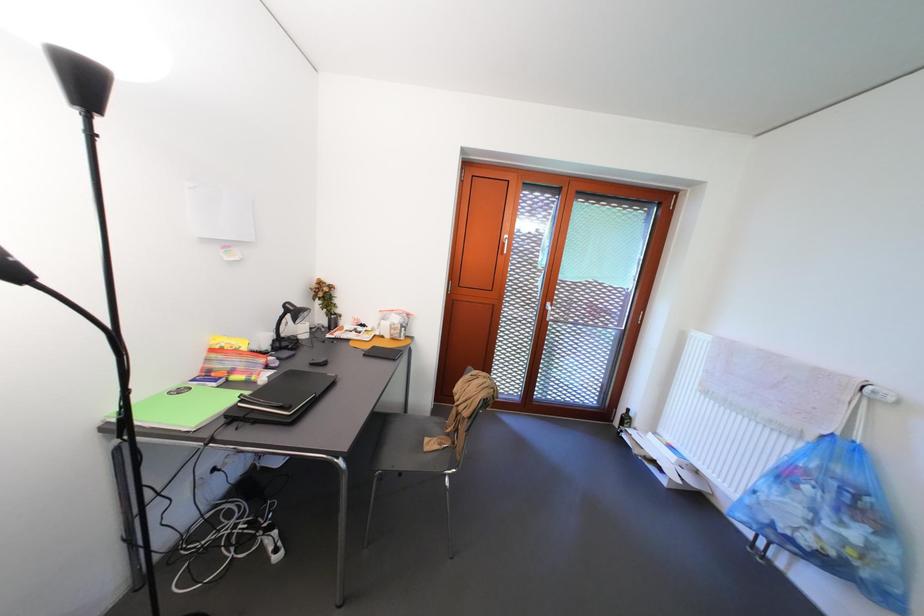
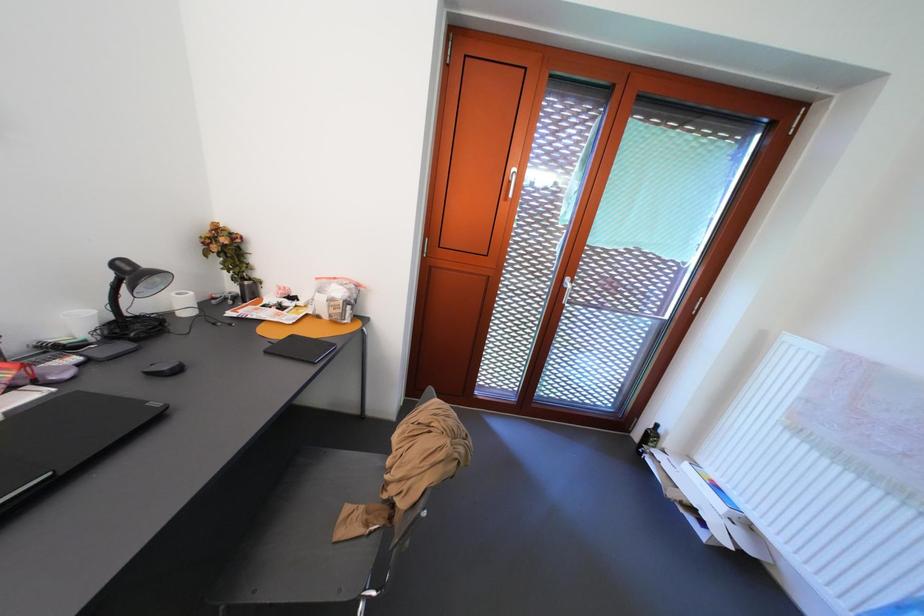
Question: The images are taken continuously from a first-person perspective. In which direction are you moving?

Choices:
 (A) Left
 (B) Right
 (C) Forward
 (D) Backward

Answer: (C)